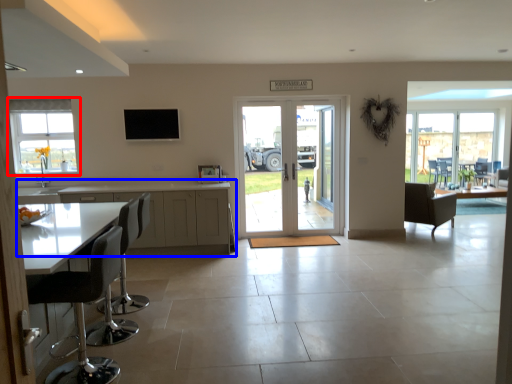
Question: Among these objects, which one is nearest to the camera, window (highlighted by a red box) or cabinetry (highlighted by a blue box)?

Choices:
 (A) window
 (B) cabinetry

Answer: (B)